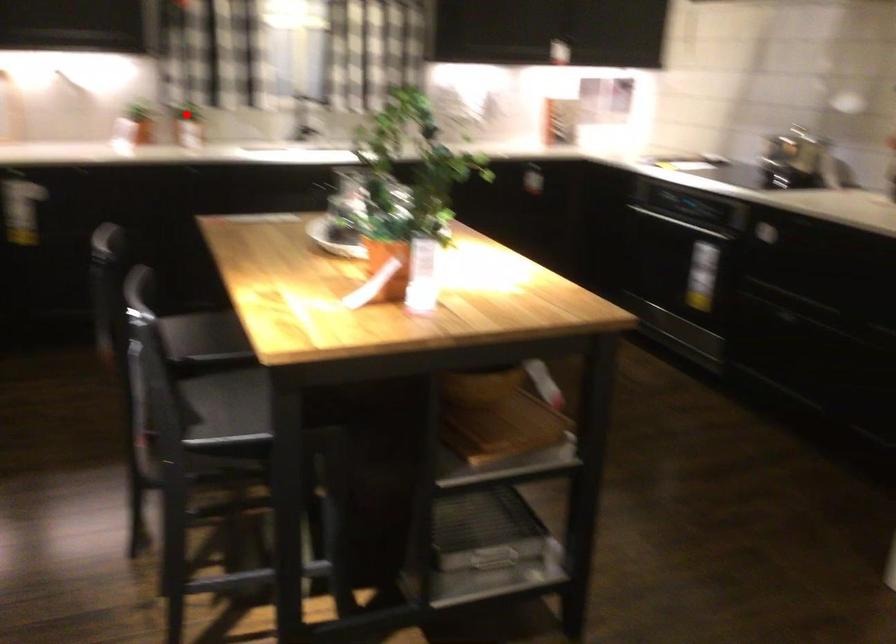
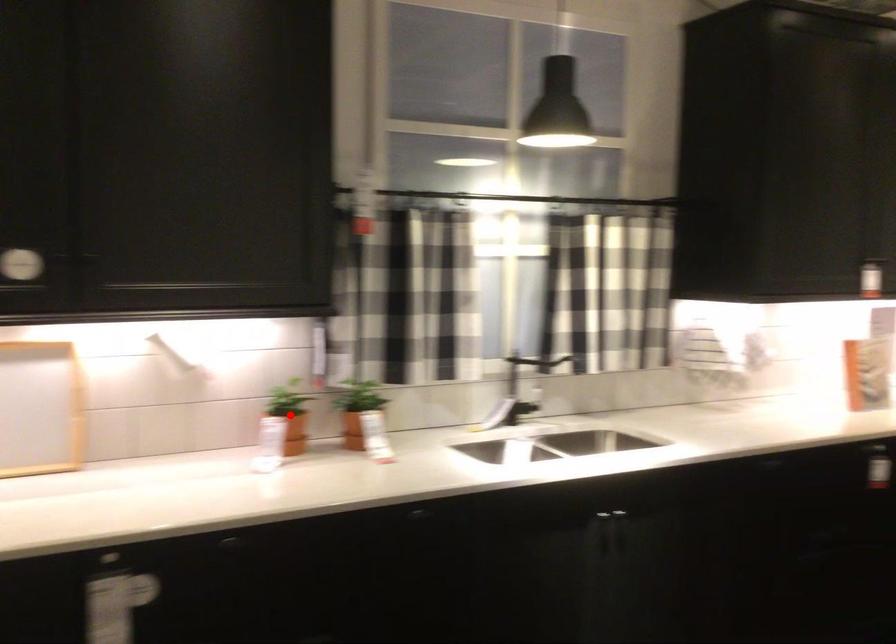
I am providing you with two images of the same scene from different viewpoints. A red point is marked on the first image and another point is marked on the second image. Does the point marked in image1 correspond to the same location as the one in image2?

No